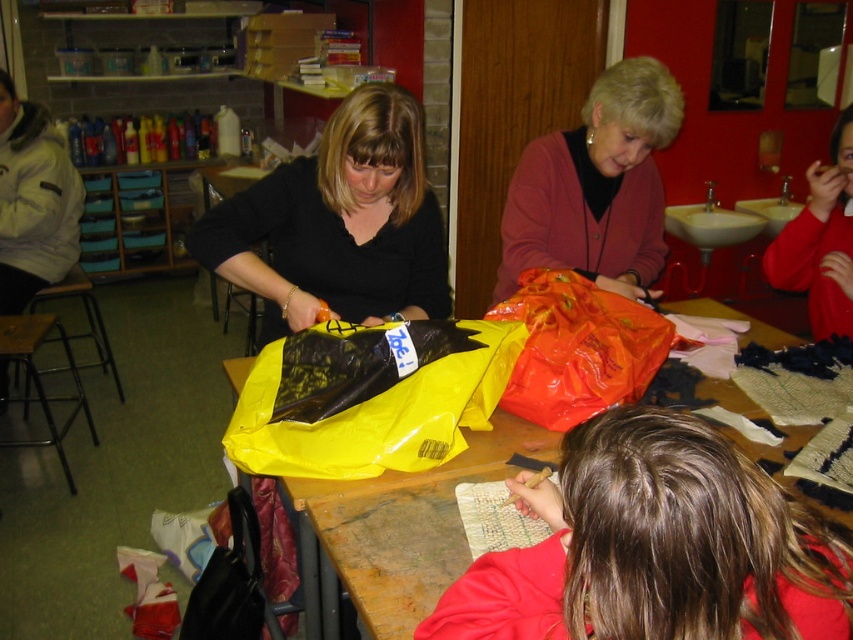
Question: Which point is farther from the camera taking this photo?

Choices:
 (A) (315, 550)
 (B) (596, 356)
 (C) (834, 164)
 (D) (746, 531)

Answer: (C)

Question: Is yellow matte plastic bag at center above wooden table at center?

Choices:
 (A) yes
 (B) no

Answer: (A)

Question: Considering the relative positions of matte black shirt at center and matte pink sweater at center in the image provided, where is matte black shirt at center located with respect to matte pink sweater at center?

Choices:
 (A) above
 (B) below

Answer: (B)

Question: Which point is closer to the camera taking this photo?

Choices:
 (A) (550, 275)
 (B) (750, 557)
 (C) (619, 282)
 (D) (461, 438)

Answer: (B)

Question: Among these points, which one is nearest to the camera?

Choices:
 (A) (502, 272)
 (B) (744, 316)

Answer: (A)

Question: Considering the relative positions of smooth red sweater at lower right and wooden table at center in the image provided, where is smooth red sweater at lower right located with respect to wooden table at center?

Choices:
 (A) right
 (B) left

Answer: (A)